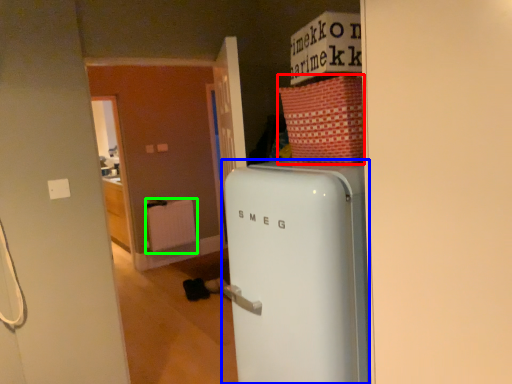
Question: Considering the real-world distances, which object is closest to cardboard box (highlighted by a red box)? refrigerator (highlighted by a blue box) or radiator (highlighted by a green box).

Choices:
 (A) refrigerator
 (B) radiator

Answer: (A)